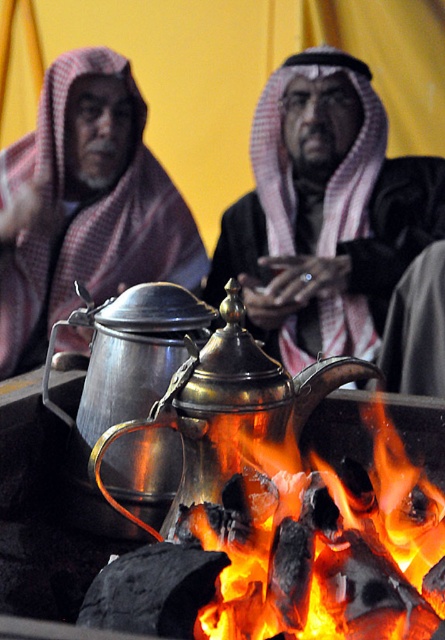
Question: Which of the following is the closest to the observer?

Choices:
 (A) charcoal fire at lower center
 (B) matte black headscarf at center

Answer: (A)

Question: Is matte black headscarf at center above shiny brass teapot at center?

Choices:
 (A) yes
 (B) no

Answer: (A)

Question: Among these points, which one is farthest from the camera?

Choices:
 (A) 94,284
 (B) 331,116
 (C) 263,630
 (D) 259,432

Answer: (B)

Question: Can you confirm if matte black robe at center is positioned below charcoal fire at lower center?

Choices:
 (A) yes
 (B) no

Answer: (B)

Question: Which is nearer to the matte black headscarf at center?

Choices:
 (A) matte black robe at center
 (B) shiny brass teapot at center

Answer: (A)

Question: Does charcoal fire at lower center have a greater width compared to shiny brass teapot at center?

Choices:
 (A) yes
 (B) no

Answer: (B)